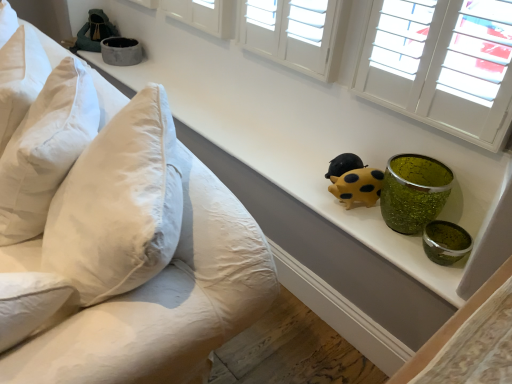
This screenshot has width=512, height=384. I want to click on vacant space in front of yellow matte pig at center, which ranks as the 2th toy in top-to-bottom order, so click(x=367, y=221).